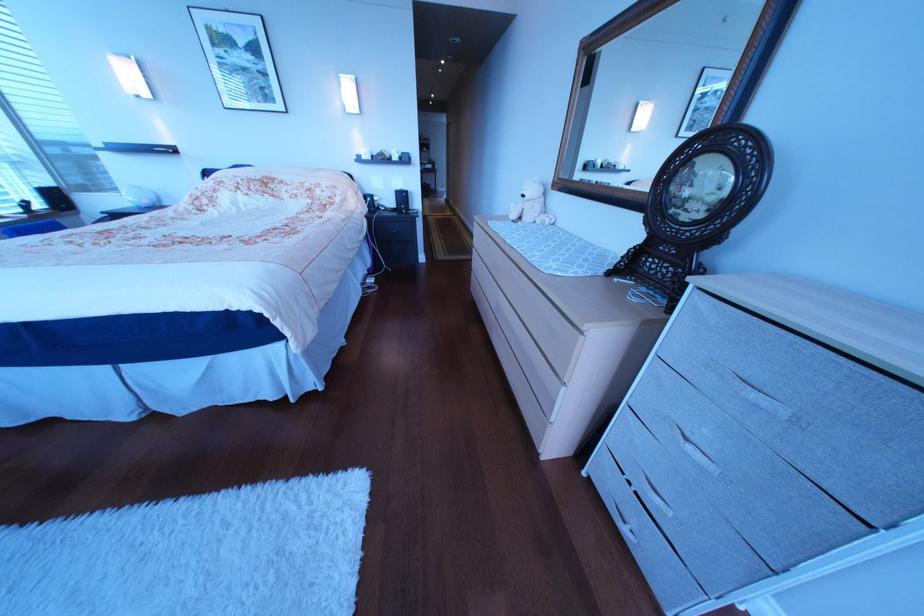
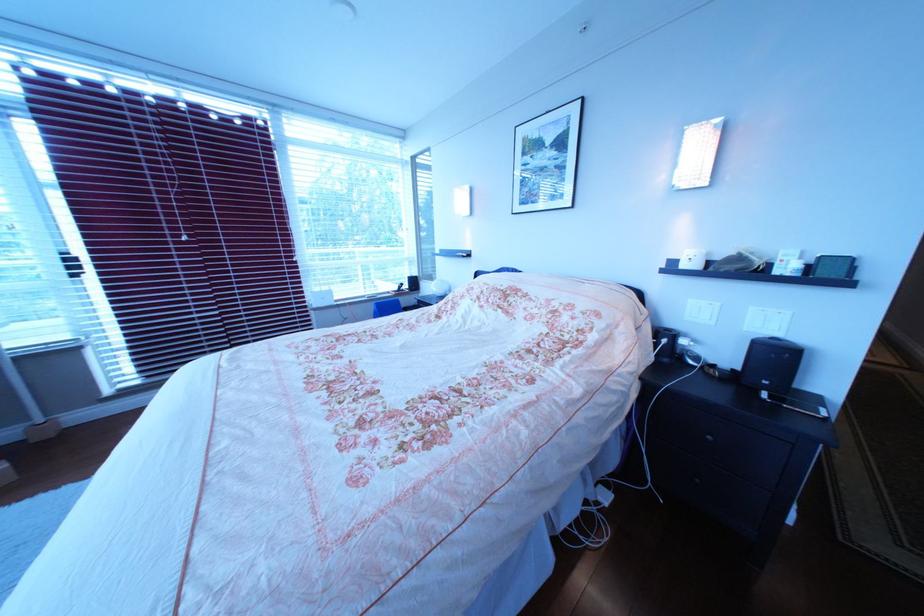
In the second image, find the point that corresponds to point (419, 209) in the first image.

(782, 384)